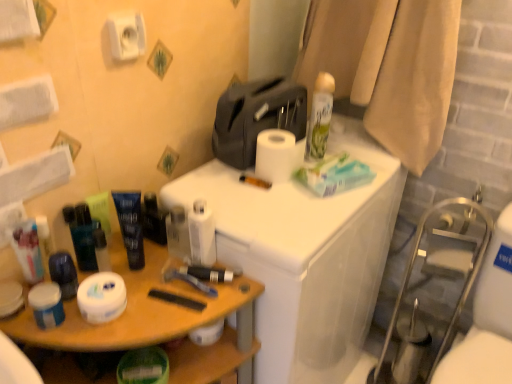
Locate an element on the screen. This screenshot has width=512, height=384. vacant area that is situated to the right of white matte jar at left, positioned as the fifth toiletry in right-to-left order is located at coordinates (142, 298).